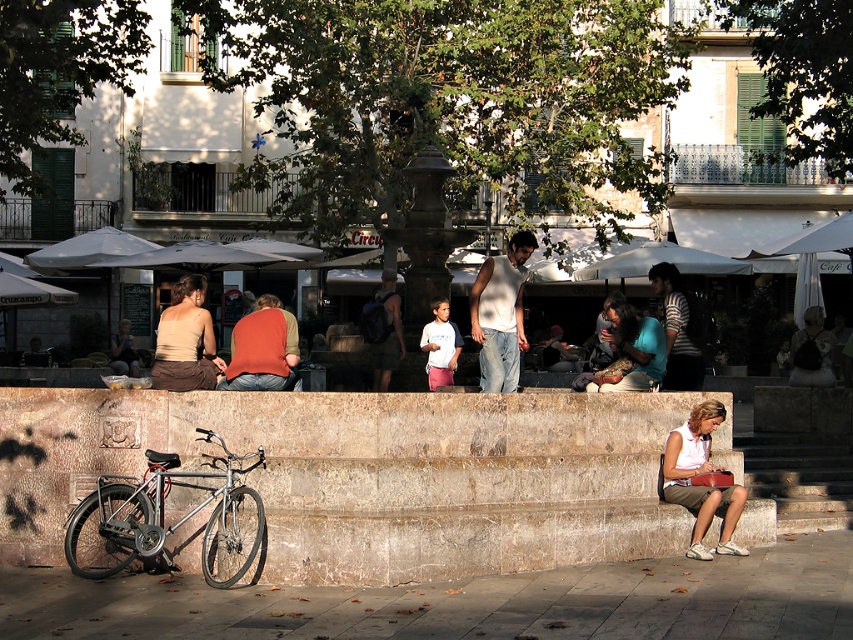
Question: Among these points, which one is farthest from the camera?

Choices:
 (A) (10, 406)
 (B) (497, 317)

Answer: (B)

Question: Does white cotton tank top at center lie behind matte black backpack at center?

Choices:
 (A) no
 (B) yes

Answer: (A)

Question: Which of the following is the closest to the observer?

Choices:
 (A) (735, 518)
 (B) (90, 545)

Answer: (B)

Question: Which point appears farthest from the camera in this image?

Choices:
 (A) (94, 403)
 (B) (605, 372)

Answer: (B)

Question: Is marble steps at center to the left of white cotton tank top at center from the viewer's perspective?

Choices:
 (A) yes
 (B) no

Answer: (A)

Question: Does matte orange sweater at center appear over matte black hair at center?

Choices:
 (A) no
 (B) yes

Answer: (B)